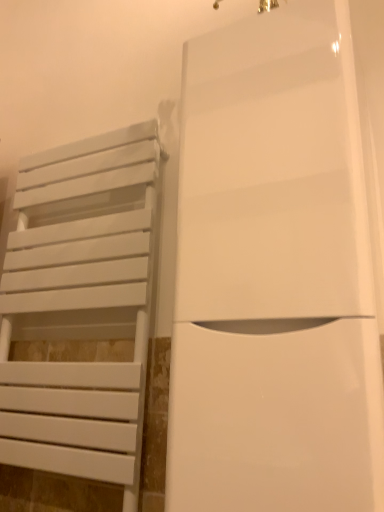
What do you see at coordinates (81, 305) in the screenshot?
I see `white matte towel rack at left` at bounding box center [81, 305].

Locate an element on the screen. white matte towel rack at left is located at coordinates (81, 305).

At what (x,y) coordinates should I click in order to perform the action: click on white glossy door at center. Please return your answer as a coordinate pair (x, y). This screenshot has height=512, width=384. Looking at the image, I should click on (274, 275).

Image resolution: width=384 pixels, height=512 pixels. What do you see at coordinates (274, 275) in the screenshot? I see `white glossy door at center` at bounding box center [274, 275].

Find the location of a particular element. This screenshot has width=384, height=512. white matte towel rack at left is located at coordinates (81, 305).

Can you confirm if white glossy door at center is positioned to the right of white matte towel rack at left?

Indeed, white glossy door at center is positioned on the right side of white matte towel rack at left.

Is the depth of white glossy door at center greater than that of white matte towel rack at left?

No, it is in front of white matte towel rack at left.

Considering the points (291, 180) and (1, 288), which point is in front, point (291, 180) or point (1, 288)?

The point (291, 180) is more forward.

In the scene shown: From the image's perspective, is white glossy door at center located above or below white matte towel rack at left?

Clearly, from the image's perspective, white glossy door at center is above white matte towel rack at left.

From a real-world perspective, is white glossy door at center under white matte towel rack at left?

Actually, white glossy door at center is physically above white matte towel rack at left in the real world.

Considering the relative sizes of white glossy door at center and white matte towel rack at left in the image provided, is white glossy door at center thinner than white matte towel rack at left?

No.

Who is shorter, white glossy door at center or white matte towel rack at left?

With less height is white glossy door at center.

Between white glossy door at center and white matte towel rack at left, which one has smaller size?

With smaller size is white matte towel rack at left.

Is white matte towel rack at left inside white glossy door at center?

No, white matte towel rack at left is located outside of white glossy door at center.

Looking at this image, is white glossy door at center next to white matte towel rack at left?

No, white glossy door at center is not in contact with white matte towel rack at left.

From the picture: Is white matte towel rack at left at the back of white glossy door at center?

That's not correct — white glossy door at center is not looking away from white matte towel rack at left.

Can you tell me how much white glossy door at center and white matte towel rack at left differ in facing direction?

The facing directions of white glossy door at center and white matte towel rack at left are 0.0538 degrees apart.

The width and height of the screenshot is (384, 512). Identify the location of door on the right of white matte towel rack at left. (274, 275).

Does white matte towel rack at left appear on the right side of white glossy door at center?

No.

Considering the relative positions of white matte towel rack at left and white glossy door at center in the image provided, is white matte towel rack at left behind white glossy door at center?

Yes, it is behind white glossy door at center.

Is point (45, 203) positioned after point (267, 443)?

Yes.

From the image's perspective, is white matte towel rack at left on white glossy door at center?

No.

From a real-world perspective, relative to white glossy door at center, is white matte towel rack at left vertically above or below?

From a real-world perspective, white matte towel rack at left is physically below white glossy door at center.

Which of these two, white matte towel rack at left or white glossy door at center, is thinner?

With smaller width is white matte towel rack at left.

In the scene shown: Is white matte towel rack at left taller or shorter than white glossy door at center?

In the image, white matte towel rack at left appears to be taller than white glossy door at center.

Between white matte towel rack at left and white glossy door at center, which one has smaller size?

white matte towel rack at left.

Is white matte towel rack at left not within white glossy door at center?

Yes, white matte towel rack at left is outside of white glossy door at center.

Is the surface of white matte towel rack at left in direct contact with white glossy door at center?

No, white matte towel rack at left is not beside white glossy door at center.

Could you tell me if white matte towel rack at left is facing white glossy door at center?

No, white matte towel rack at left is not aimed at white glossy door at center.

Where is `door on the right of white matte towel rack at left`? Image resolution: width=384 pixels, height=512 pixels. door on the right of white matte towel rack at left is located at coordinates (274, 275).

Image resolution: width=384 pixels, height=512 pixels. Identify the location of door lying above the white matte towel rack at left (from the image's perspective). (274, 275).

Locate an element on the screen. Image resolution: width=384 pixels, height=512 pixels. furniture located below the white glossy door at center (from the image's perspective) is located at coordinates (81, 305).